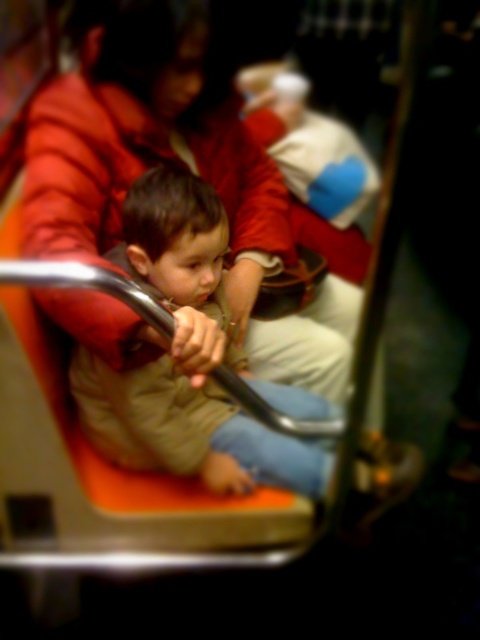
Consider the image. Is matte red jacket at upper left closer to the viewer compared to khaki fabric jacket at center?

Yes, matte red jacket at upper left is closer to the viewer.

How much distance is there between matte red jacket at upper left and khaki fabric jacket at center?

A distance of 18.20 centimeters exists between matte red jacket at upper left and khaki fabric jacket at center.

Locate an element on the screen. matte red jacket at upper left is located at coordinates (176, 163).